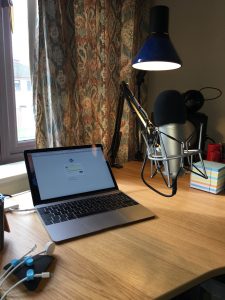
This screenshot has height=300, width=225. I want to click on window, so click(x=23, y=118).